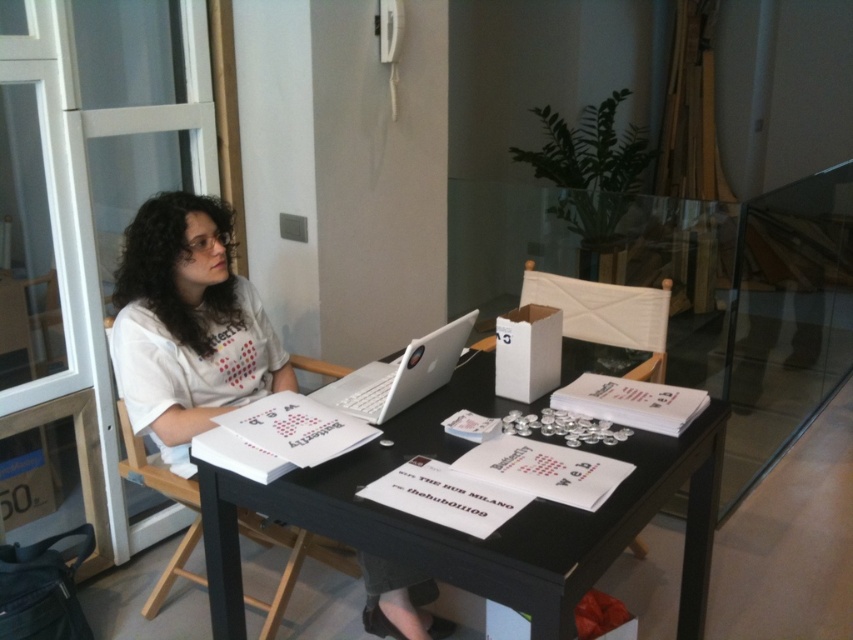
From the picture: You are organizing a meeting in this workspace and need to place a large presentation board on the table. Which table should you choose between the transparent glass table at center and the black glossy table at center to ensure the board fits without overhanging?

The transparent glass table at center is bigger than the black glossy table at center, so the large presentation board should be placed on the transparent glass table at center to ensure it fits without overhanging.

You are a delivery person who needs to place a package on the table. The package is 1 meter long. Can you fit it on the black glossy table at center without moving the silver metallic laptop at center?

The black glossy table at center is closer to the viewer than the silver metallic laptop at center, but the description does not provide information about the table dimensions or the laptop size. Therefore, it is impossible to determine if the package will fit without additional details.